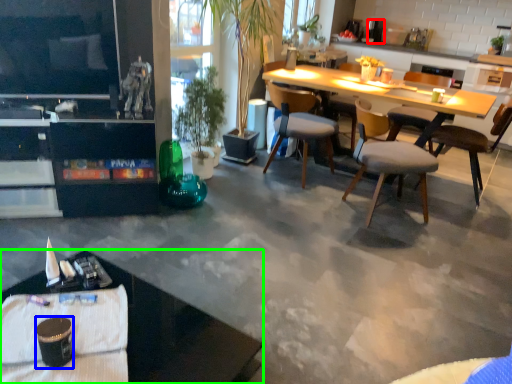
Question: Based on their relative distances, which object is farther from coffee maker (highlighted by a red box)? Choose from coffee cup (highlighted by a blue box) and desk (highlighted by a green box).

Choices:
 (A) coffee cup
 (B) desk

Answer: (A)